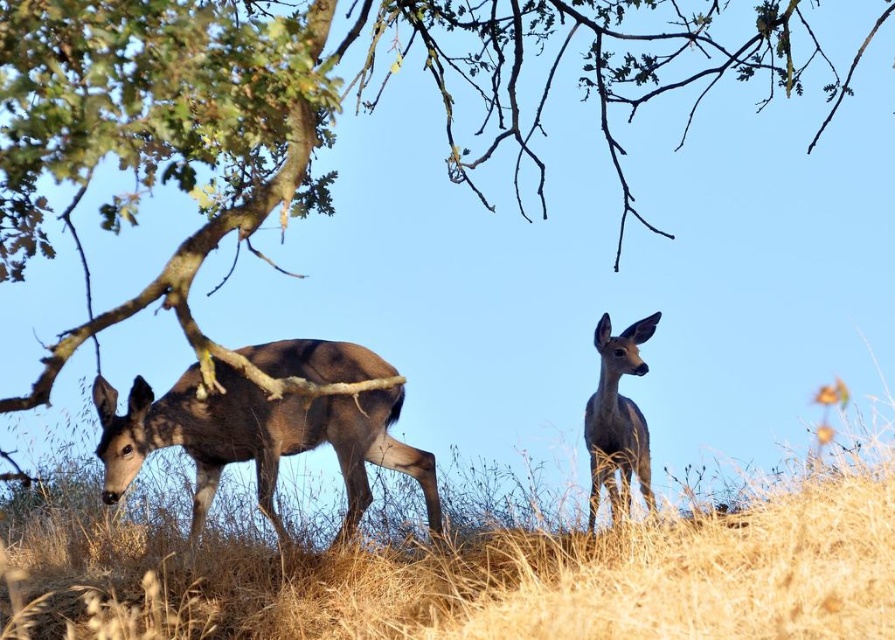
You are standing at the origin point in the coordinate system of this image. You want to walk towards the brown matte deer at left. Which direction should you head in?

You should head towards the coordinates point (256, 440) to reach the brown matte deer at left.

You are standing at the base of the hill in the image and want to walk towards the two points marked on the hill. Which point, point (330, 381) or point (619, 412), would you reach first?

Point (330, 381) is in front of point (619, 412), so you would reach point (330, 381) first.